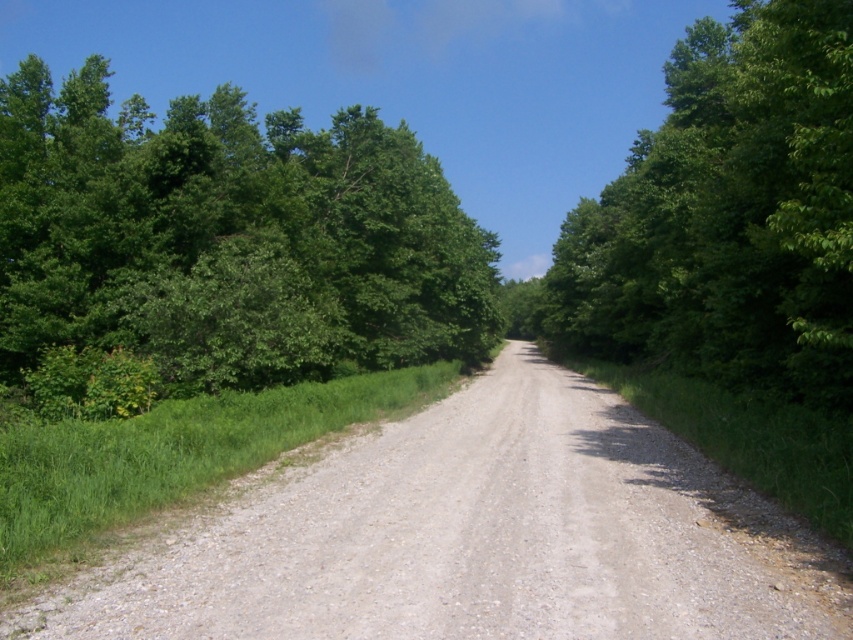
Which is above, green leafy tree at left or green leafy tree at right?

Positioned higher is green leafy tree at left.

Which is more to the right, green leafy tree at left or green leafy tree at right?

From the viewer's perspective, green leafy tree at right appears more on the right side.

Find the location of `green leafy tree at left`. green leafy tree at left is located at coordinates (223, 243).

This screenshot has height=640, width=853. What are the coordinates of `green leafy tree at left` in the screenshot? It's located at (223, 243).

Is gray gravel road at center positioned behind green leafy tree at right?

No, it is in front of green leafy tree at right.

Does point (91, 566) come farther from viewer compared to point (636, 339)?

No.

Find the location of a particular element. The image size is (853, 640). gray gravel road at center is located at coordinates (471, 536).

Is gray gravel road at center further to the viewer compared to green leafy tree at left?

That is False.

Does gray gravel road at center have a lesser height compared to green leafy tree at left?

Yes, gray gravel road at center is shorter than green leafy tree at left.

I want to click on gray gravel road at center, so click(471, 536).

Locate an element on the screen. gray gravel road at center is located at coordinates (471, 536).